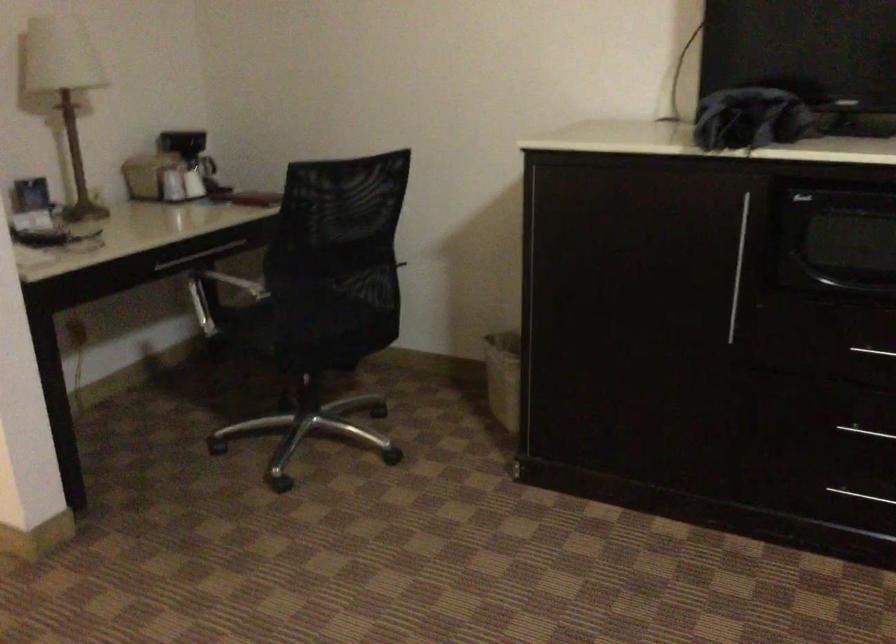
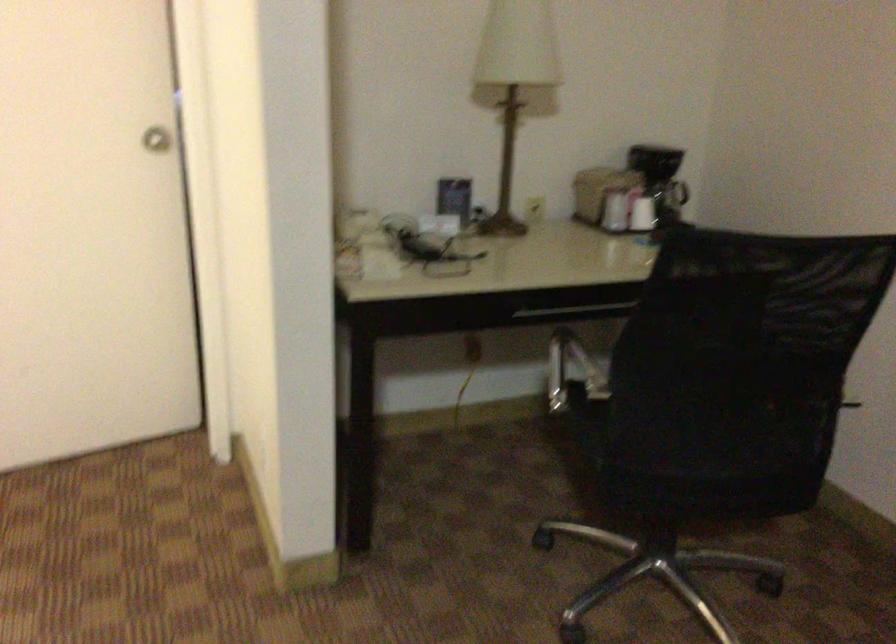
Locate, in the second image, the point that corresponds to point (194, 182) in the first image.

(642, 214)